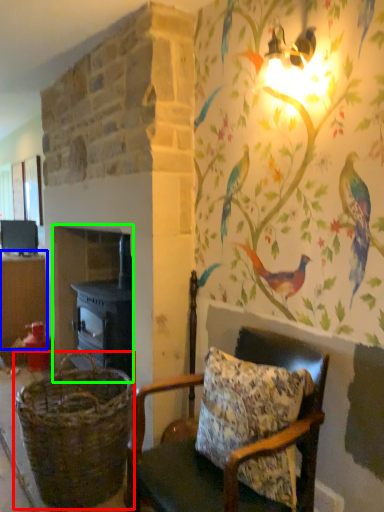
Question: Which object is positioned farthest from basket (highlighted by a red box)? Select from table (highlighted by a blue box) and fireplace (highlighted by a green box).

Choices:
 (A) table
 (B) fireplace

Answer: (A)